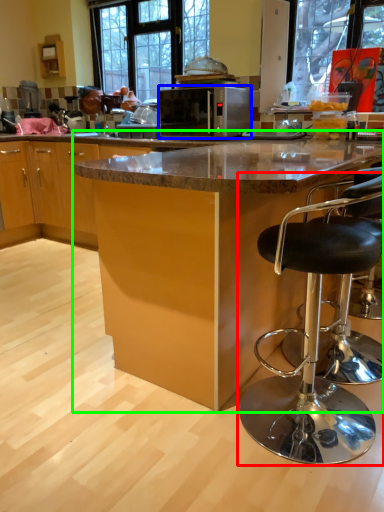
Question: Considering the real-world distances, which object is farthest from chair (highlighted by a red box)? microwave oven (highlighted by a blue box) or table (highlighted by a green box)?

Choices:
 (A) microwave oven
 (B) table

Answer: (A)